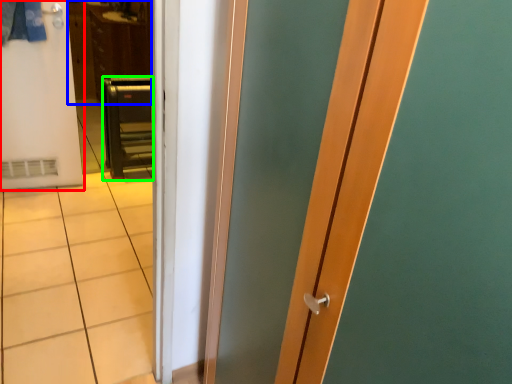
Question: Estimate the real-world distances between objects in this image. Which object is farther from door (highlighted by a red box), dresser (highlighted by a blue box) or furniture (highlighted by a green box)?

Choices:
 (A) dresser
 (B) furniture

Answer: (A)